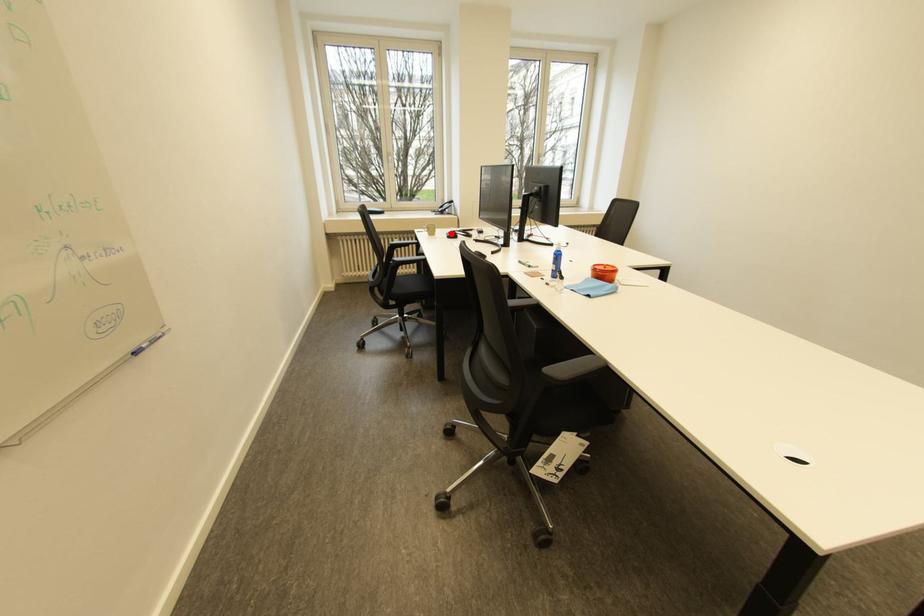
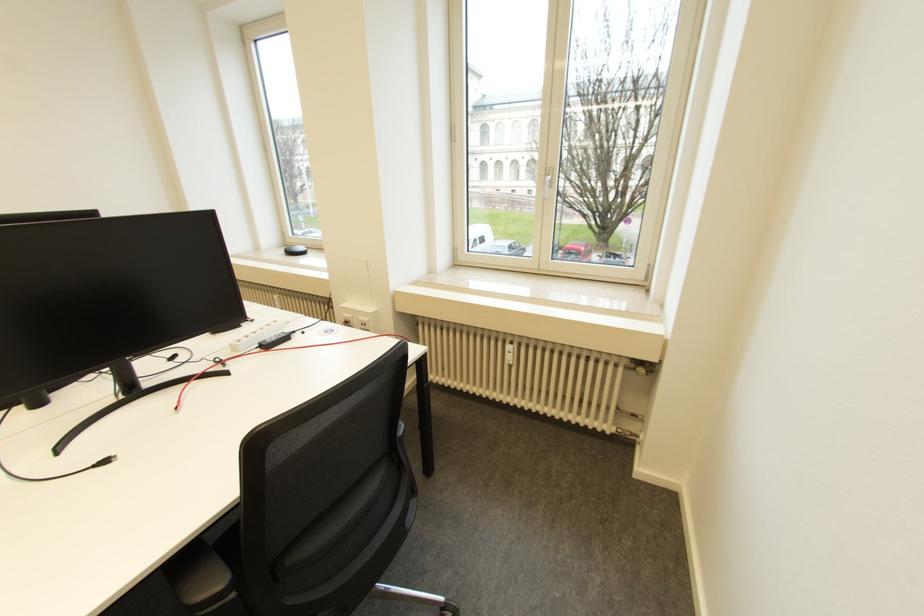
Question: I am providing you with two images of the same scene from different viewpoints. A red point is marked on the first image. Can you still see the location of the red point in image 2?

Choices:
 (A) Yes
 (B) No

Answer: (B)